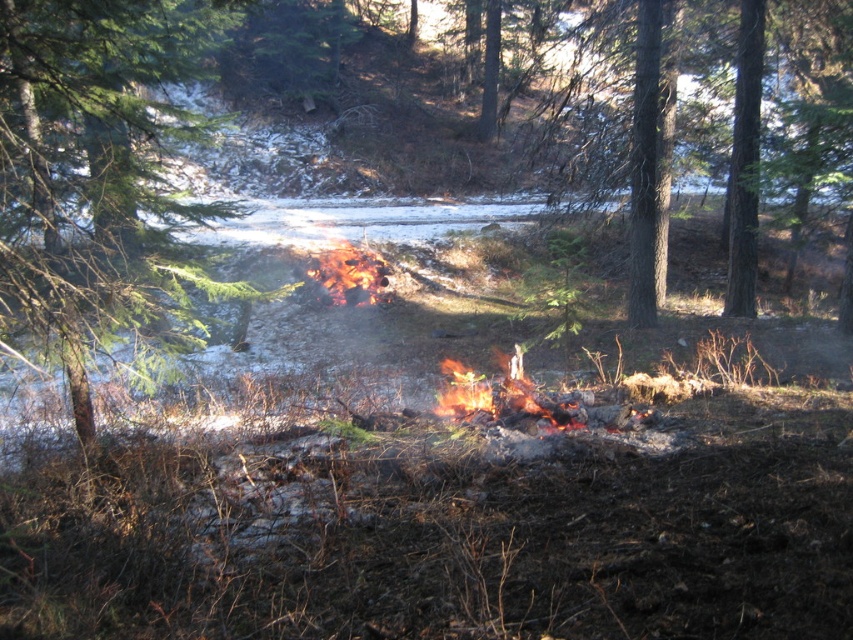
Question: Which point appears closest to the camera in this image?

Choices:
 (A) (512, 376)
 (B) (381, 268)
 (C) (129, 320)

Answer: (C)

Question: Where is charred wood fire at center located in relation to flamematerial/texture fire at center in the image?

Choices:
 (A) right
 (B) left

Answer: (A)

Question: From the image, what is the correct spatial relationship of charred wood fire at center in relation to flamematerial/texture fire at center?

Choices:
 (A) below
 (B) above

Answer: (A)

Question: Observing the image, what is the correct spatial positioning of charred wood fire at center in reference to flamematerial/texture fire at center?

Choices:
 (A) below
 (B) above

Answer: (A)

Question: Which object is positioned farthest from the green leafy tree at center?

Choices:
 (A) charred wood fire at center
 (B) flamematerial/texture fire at center

Answer: (B)

Question: Which of the following is the closest to the observer?

Choices:
 (A) (543, 413)
 (B) (169, 252)

Answer: (A)